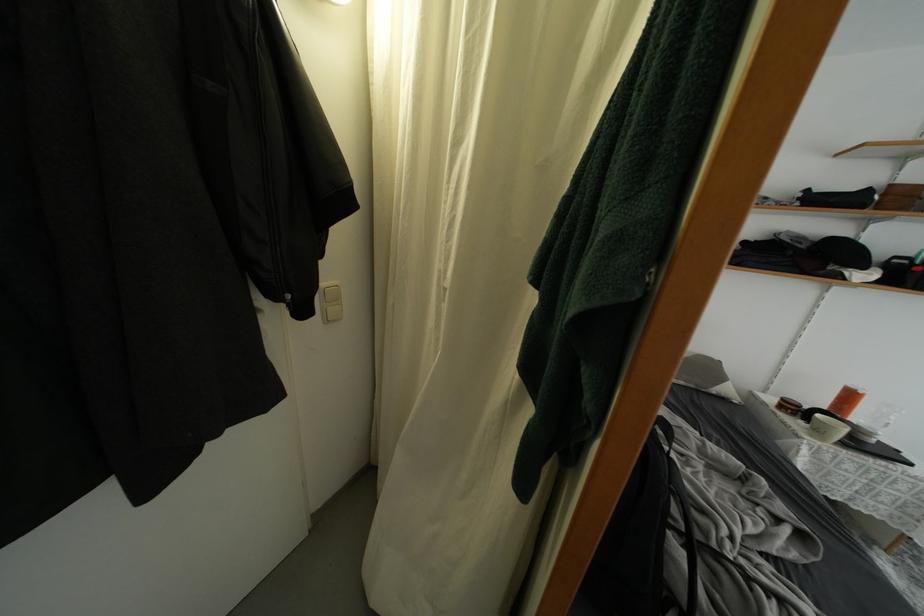
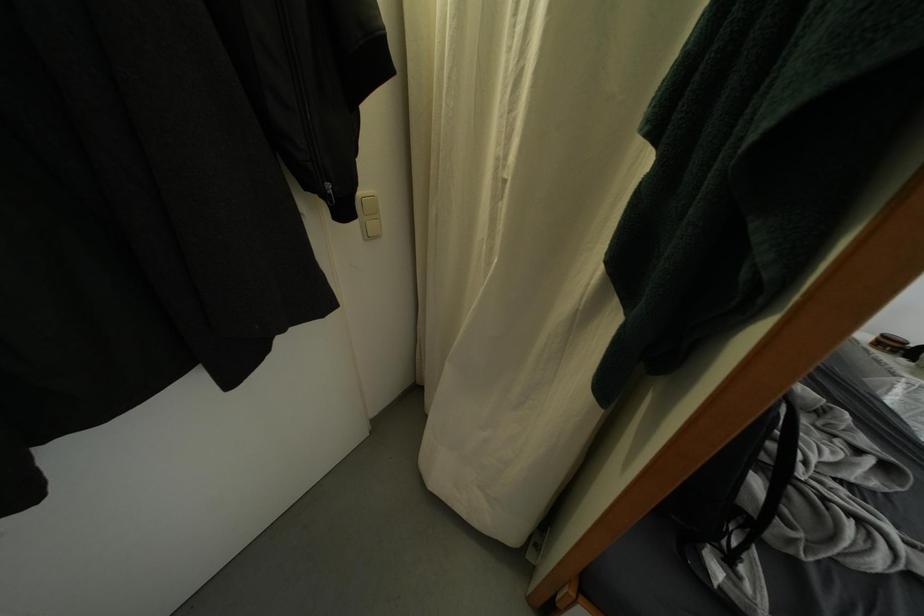
Where in the second image is the point corresponding to point (329, 320) from the first image?

(368, 236)